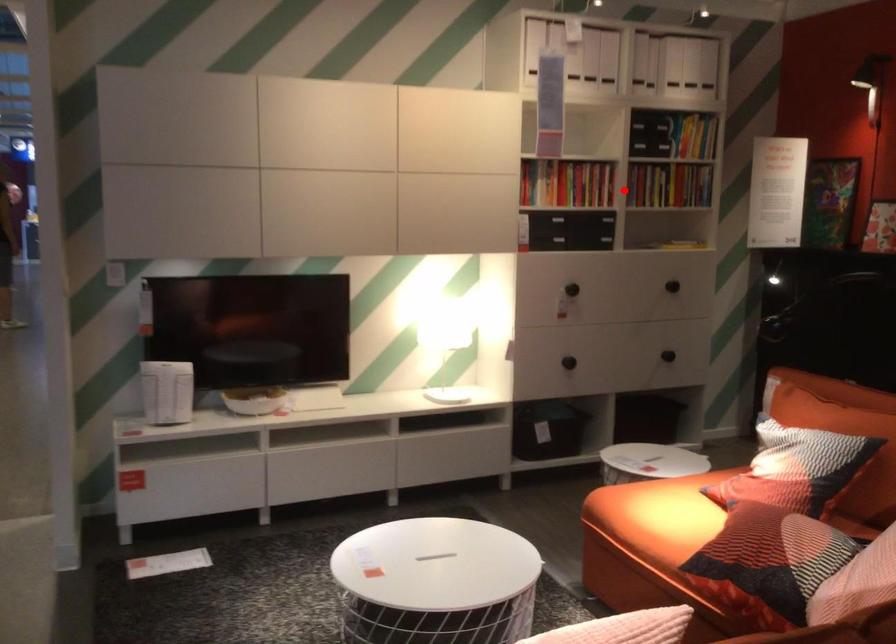
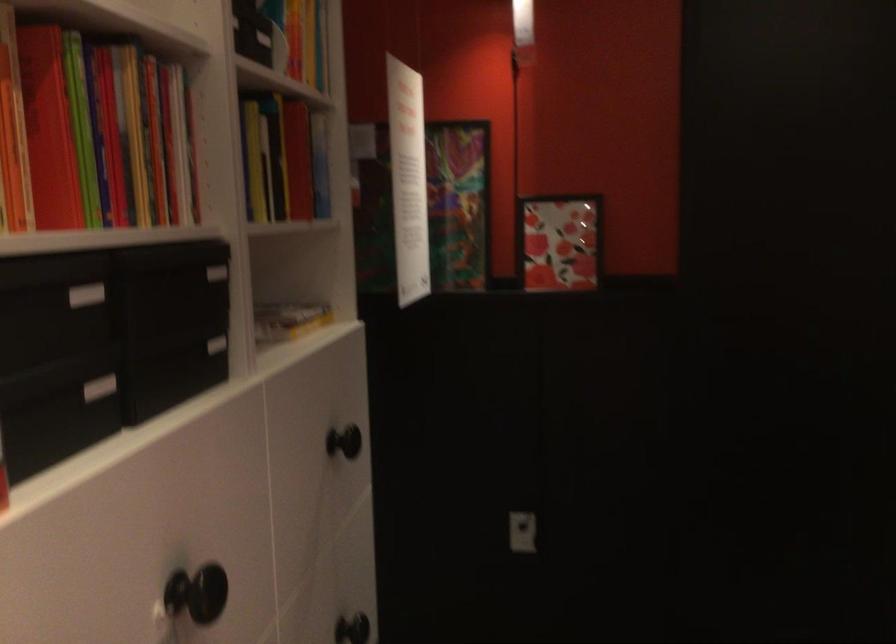
In the second image, find the point that corresponds to the highlighted location in the first image.

(216, 272)